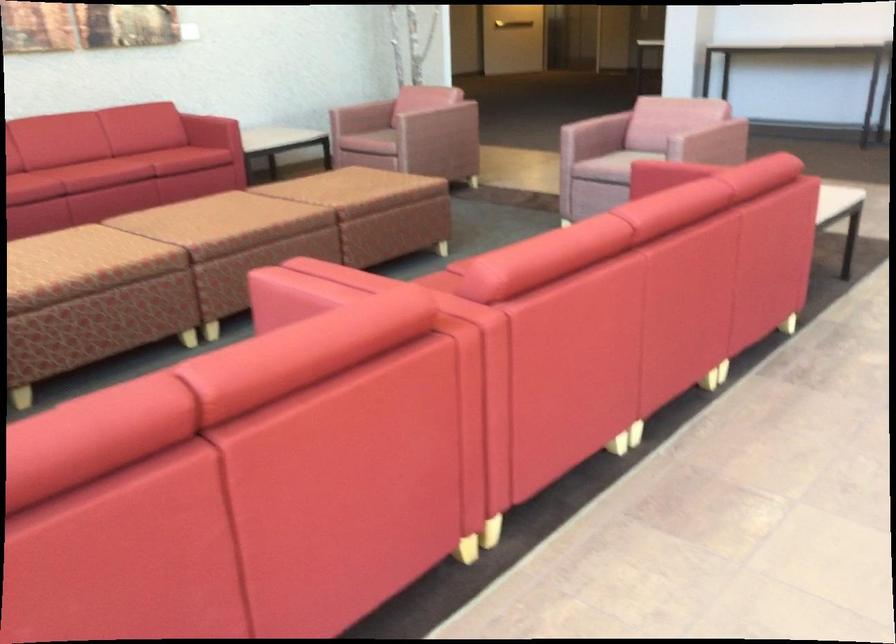
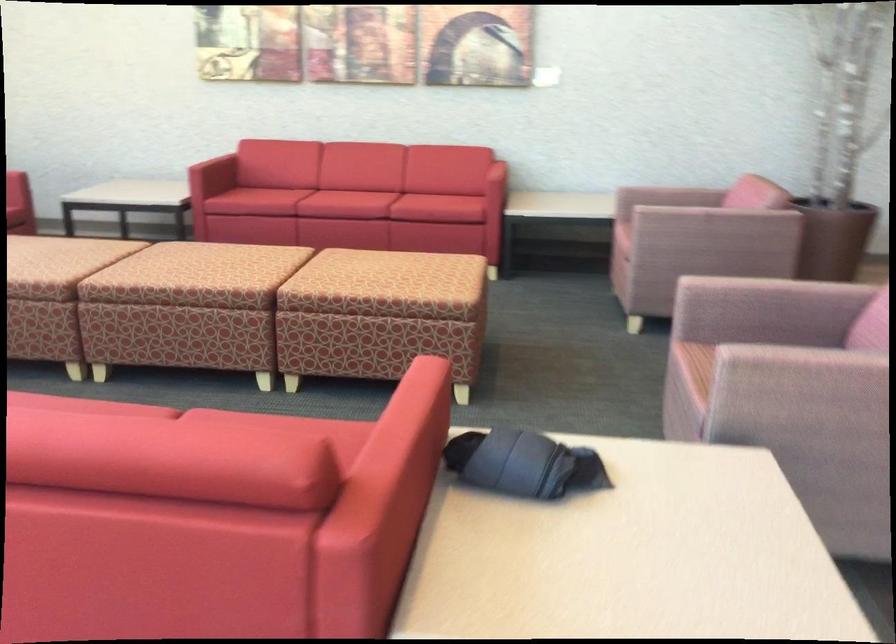
In the second image, find the point that corresponds to point (757, 162) in the first image.

(173, 442)